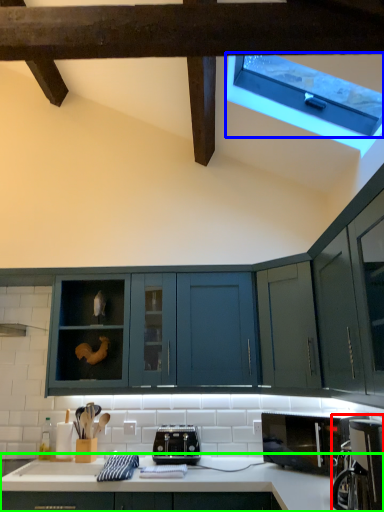
Question: Considering the real-world distances, which object is farthest from coffee machine (highlighted by a red box)? window (highlighted by a blue box) or countertop (highlighted by a green box)?

Choices:
 (A) window
 (B) countertop

Answer: (A)